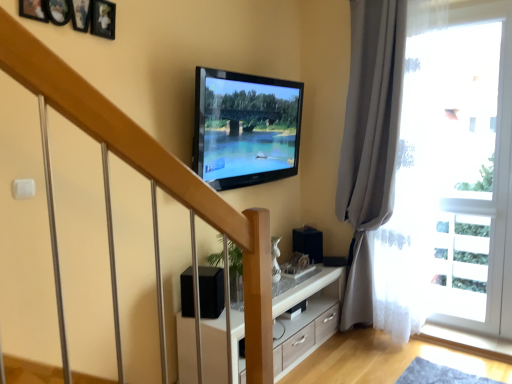
Question: From a real-world perspective, is transparent glass door at right beneath white wood cabinet at center?

Choices:
 (A) no
 (B) yes

Answer: (A)

Question: Considering the relative sizes of transparent glass door at right and white wood cabinet at center in the image provided, is transparent glass door at right thinner than white wood cabinet at center?

Choices:
 (A) no
 (B) yes

Answer: (B)

Question: Is transparent glass door at right at the left side of white wood cabinet at center?

Choices:
 (A) no
 (B) yes

Answer: (A)

Question: Are transparent glass door at right and white wood cabinet at center located far from each other?

Choices:
 (A) no
 (B) yes

Answer: (A)

Question: Does transparent glass door at right have a greater width compared to white wood cabinet at center?

Choices:
 (A) no
 (B) yes

Answer: (A)

Question: From the image's perspective, is flat screen tv at upper center located above or below white wood cabinet at center?

Choices:
 (A) above
 (B) below

Answer: (A)

Question: Does point (208, 102) appear closer or farther from the camera than point (244, 329)?

Choices:
 (A) farther
 (B) closer

Answer: (A)

Question: From a real-world perspective, relative to white wood cabinet at center, is flat screen tv at upper center vertically above or below?

Choices:
 (A) below
 (B) above

Answer: (B)

Question: Is flat screen tv at upper center bigger or smaller than white wood cabinet at center?

Choices:
 (A) big
 (B) small

Answer: (B)

Question: Considering the positions of transparent glass door at right and flat screen tv at upper center in the image, is transparent glass door at right bigger or smaller than flat screen tv at upper center?

Choices:
 (A) big
 (B) small

Answer: (B)

Question: From the image's perspective, is transparent glass door at right located above or below flat screen tv at upper center?

Choices:
 (A) above
 (B) below

Answer: (B)

Question: Looking at their shapes, would you say transparent glass door at right is wider or thinner than flat screen tv at upper center?

Choices:
 (A) wide
 (B) thin

Answer: (B)

Question: Considering the positions of transparent glass door at right and flat screen tv at upper center in the image, is transparent glass door at right taller or shorter than flat screen tv at upper center?

Choices:
 (A) short
 (B) tall

Answer: (B)

Question: In terms of height, does transparent glass door at right look taller or shorter compared to gray fabric curtain at right?

Choices:
 (A) short
 (B) tall

Answer: (A)

Question: Which is correct: transparent glass door at right is inside gray fabric curtain at right, or outside of it?

Choices:
 (A) outside
 (B) inside

Answer: (A)